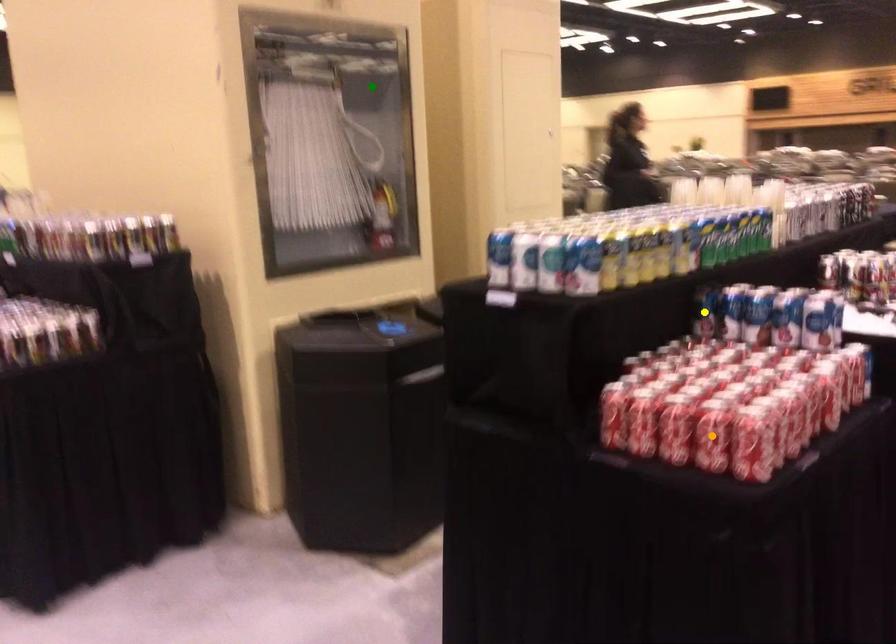
Order these from nearest to farthest:
green point, yellow point, orange point

green point < yellow point < orange point